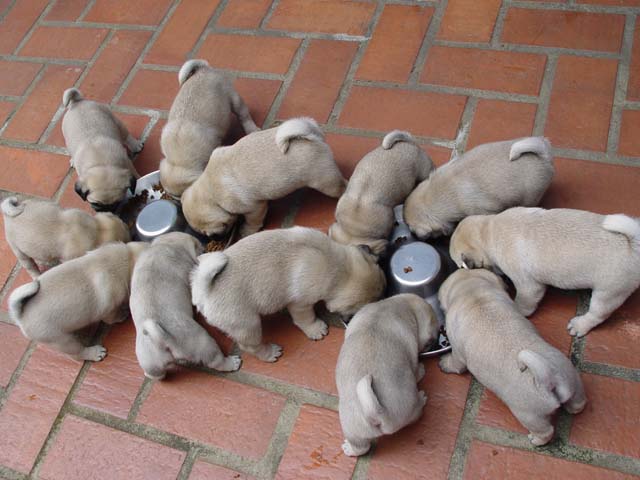
You are a GUI agent. You are given a task and a screenshot of the screen. Output one action in this format:
    pyautogui.click(x=<x>, y=<y>)
    Task: Click on the two metallic bowls
    
    Given the screenshot: What is the action you would take?
    pyautogui.click(x=429, y=266), pyautogui.click(x=153, y=215)